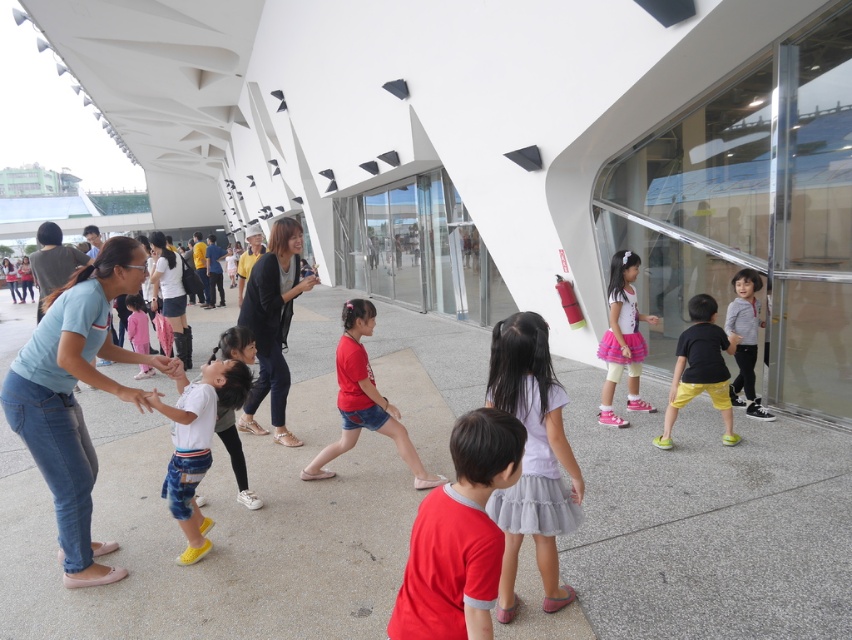
Based on the photo, you are a photographer standing in front of the modern building. You see a pale purple tulle skirt at center and a white matte shirt at center. Which one is more to the right?

The pale purple tulle skirt at center is more to the right because it is positioned on the right side of the white matte shirt at center.

You are standing at the center of the image and want to locate the striped cotton shirt at right. According to the coordinates provided, in which direction should you look to find it?

The striped cotton shirt at right is located at coordinates point (746, 340). Since you are at the center, you should look to the right side of the image to find it.

You are a photographer trying to capture a shot of the striped cotton shirt at right and the matte black jacket at upper left. Which object should you focus on first if you want to ensure both are in the frame without moving the camera?

The striped cotton shirt at right is positioned under matte black jacket at upper left, so you should focus on the matte black jacket at upper left first to ensure both are in the frame without moving the camera.